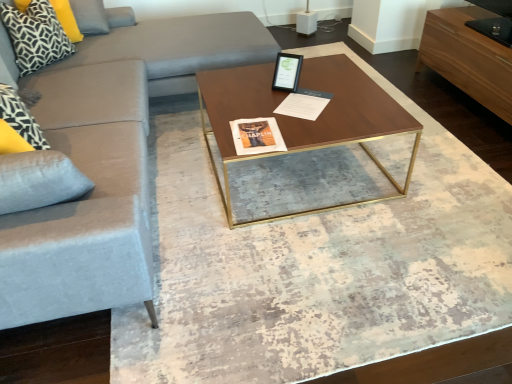
Question: Is velvet light gray couch at left inside patterned fabric pillow at upper left, the second pillow from the back?

Choices:
 (A) no
 (B) yes

Answer: (A)

Question: Can you see patterned fabric pillow at upper left, the second pillow from the back, touching velvet light gray couch at left?

Choices:
 (A) yes
 (B) no

Answer: (B)

Question: Is velvet light gray couch at left at the back of patterned fabric pillow at upper left, the second pillow from the back?

Choices:
 (A) no
 (B) yes

Answer: (A)

Question: Is patterned fabric pillow at upper left, the second pillow from the back, closer to camera compared to velvet light gray couch at left?

Choices:
 (A) yes
 (B) no

Answer: (B)

Question: Can you confirm if patterned fabric pillow at upper left, the second pillow from the back, is positioned to the right of velvet light gray couch at left?

Choices:
 (A) yes
 (B) no

Answer: (B)

Question: Does patterned fabric pillow at upper left, the second pillow from the back, have a lesser width compared to velvet light gray couch at left?

Choices:
 (A) no
 (B) yes

Answer: (B)

Question: Are black and white geometric pillow at upper left, which appears as the 1th pillow when viewed from the back, and walnut wood coffee table at center making contact?

Choices:
 (A) no
 (B) yes

Answer: (A)

Question: Is black and white geometric pillow at upper left, the 2th pillow viewed from the front, thinner than walnut wood coffee table at center?

Choices:
 (A) yes
 (B) no

Answer: (A)

Question: Is black and white geometric pillow at upper left, which appears as the 1th pillow when viewed from the back, at the left side of walnut wood coffee table at center?

Choices:
 (A) no
 (B) yes

Answer: (B)

Question: From the image's perspective, does black and white geometric pillow at upper left, the 2th pillow viewed from the front, appear lower than walnut wood coffee table at center?

Choices:
 (A) no
 (B) yes

Answer: (A)

Question: Does black and white geometric pillow at upper left, which appears as the 1th pillow when viewed from the back, have a larger size compared to walnut wood coffee table at center?

Choices:
 (A) yes
 (B) no

Answer: (B)

Question: Are black and white geometric pillow at upper left, which appears as the 1th pillow when viewed from the back, and walnut wood coffee table at center located far from each other?

Choices:
 (A) no
 (B) yes

Answer: (B)

Question: Is walnut wood coffee table at center not near black and white geometric pillow at upper left, the 2th pillow viewed from the front?

Choices:
 (A) no
 (B) yes

Answer: (B)